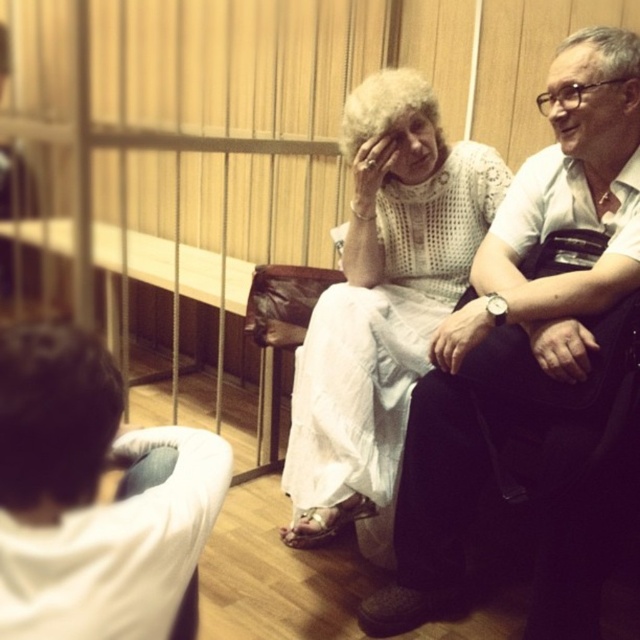
You are a photographer trying to capture a candid shot of both the white fabric shirt at upper right and the white lace dress at center. Since you want to include both in the frame, which direction should you move your camera to ensure both are visible?

You should move your camera to the left to ensure both the white fabric shirt at upper right and the white lace dress at center are visible, as the white fabric shirt at upper right is positioned to the right of the white lace dress at center.

You are standing in the room and want to move from the point at coordinates point (x=321, y=353) to the point at coordinates point (x=32, y=445). Which direction should you move to reach your destination?

To move from point (x=321, y=353) to point (x=32, y=445), you should move downward and to the right since point (x=32, y=445) is located below and to the right of point (x=321, y=353).